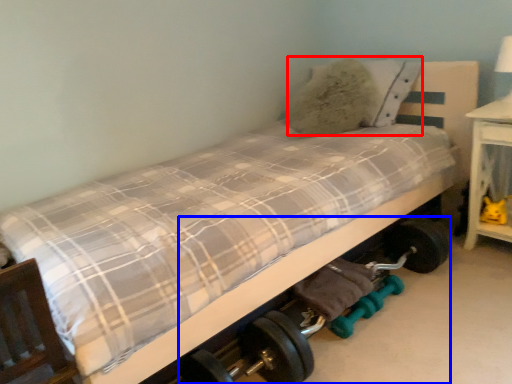
Question: Among these objects, which one is farthest to the camera, pillow (highlighted by a red box) or baby carriage (highlighted by a blue box)?

Choices:
 (A) pillow
 (B) baby carriage

Answer: (A)